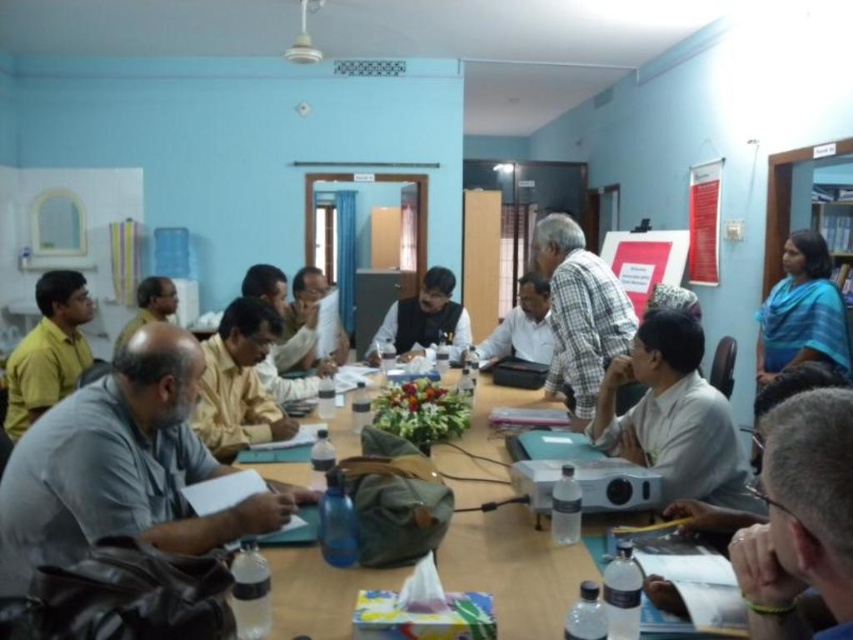
Is dark gray fabric vest at center taller than matte black shirt at center?

No, dark gray fabric vest at center is not taller than matte black shirt at center.

Does dark gray fabric vest at center appear under matte black shirt at center?

Indeed, dark gray fabric vest at center is positioned under matte black shirt at center.

Find the location of a particular element. dark gray fabric vest at center is located at coordinates (425, 320).

Find the location of a particular element. dark gray fabric vest at center is located at coordinates (425, 320).

Does matte black shirt at center have a larger size compared to red paperboard at upper right?

Indeed, matte black shirt at center has a larger size compared to red paperboard at upper right.

Is point (335, 308) less distant than point (705, 248)?

Yes, point (335, 308) is closer to viewer.

Find the location of a particular element. matte black shirt at center is located at coordinates (315, 317).

Based on the photo, between gray fabric shirt at left and red paperboard at upper right, which one is positioned higher?

red paperboard at upper right is above.

Who is more forward, (x=39, y=531) or (x=720, y=160)?

Point (x=39, y=531)

In order to click on gray fabric shirt at left in this screenshot , I will do `click(123, 467)`.